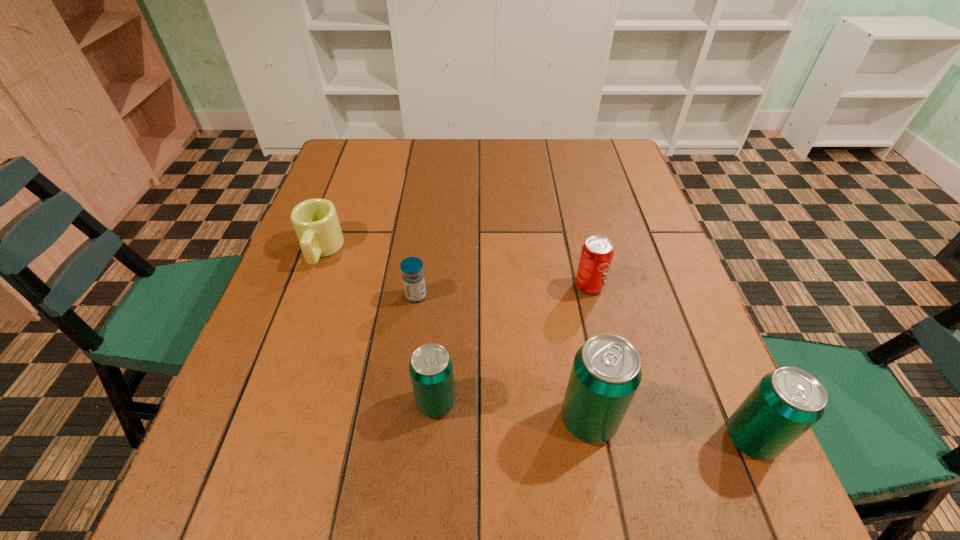
Where is `free space between the soda and the rightmost object`? This screenshot has width=960, height=540. free space between the soda and the rightmost object is located at coordinates (670, 362).

I want to click on object that is the fourth closest to the shortest beer can, so click(315, 221).

Locate an element on the screen. This screenshot has width=960, height=540. object that is the third closest one to the fifth object from right to left is located at coordinates (597, 252).

I want to click on beer can that is the second nearest to the fifth shortest object, so click(431, 367).

Identify which beer can is the closest to the rightmost beer can. Please provide its 2D coordinates. Your answer should be formatted as a tuple, i.e. [(x, y)], where the tuple contains the x and y coordinates of a point satisfying the conditions above.

[(606, 372)]

Image resolution: width=960 pixels, height=540 pixels. I want to click on free location that satisfies the following two spatial constraints: 1. with the handle on the side of the mug; 2. on the left side of the rightmost beer can, so click(x=252, y=438).

Where is `free location that satisfies the following two spatial constraints: 1. on the front side of the leftmost beer can; 2. on the left side of the second object from left to right`? The image size is (960, 540). free location that satisfies the following two spatial constraints: 1. on the front side of the leftmost beer can; 2. on the left side of the second object from left to right is located at coordinates (402, 402).

Where is `vacant area that satisfies the following two spatial constraints: 1. on the front side of the second shortest beer can; 2. on the left side of the medicine`? The width and height of the screenshot is (960, 540). vacant area that satisfies the following two spatial constraints: 1. on the front side of the second shortest beer can; 2. on the left side of the medicine is located at coordinates (397, 438).

Where is `free spot that satisfies the following two spatial constraints: 1. with the handle on the side of the leftmost object; 2. on the left side of the soda`? This screenshot has width=960, height=540. free spot that satisfies the following two spatial constraints: 1. with the handle on the side of the leftmost object; 2. on the left side of the soda is located at coordinates (308, 286).